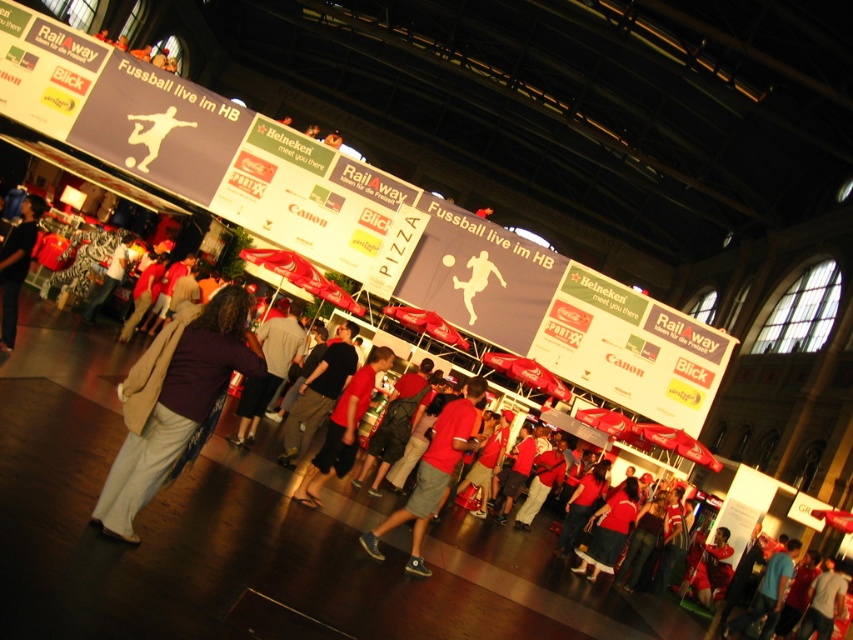
Question: Which point is farther to the camera?

Choices:
 (A) (200, 308)
 (B) (33, 212)
 (C) (345, 417)

Answer: (C)

Question: Does purple matte shirt at lower left lie in front of red cotton shirt at center?

Choices:
 (A) no
 (B) yes

Answer: (B)

Question: Which object is the farthest from the red cotton t-shirt at center?

Choices:
 (A) dark gray jacket at left
 (B) red cotton shirt at center
 (C) purple matte shirt at lower left

Answer: (A)

Question: Which of the following is the farthest from the observer?

Choices:
 (A) purple matte shirt at lower left
 (B) red cotton shirt at center

Answer: (B)

Question: Is purple matte shirt at lower left below dark gray jacket at left?

Choices:
 (A) no
 (B) yes

Answer: (B)

Question: Does purple matte shirt at lower left have a lesser width compared to red cotton t-shirt at center?

Choices:
 (A) yes
 (B) no

Answer: (A)